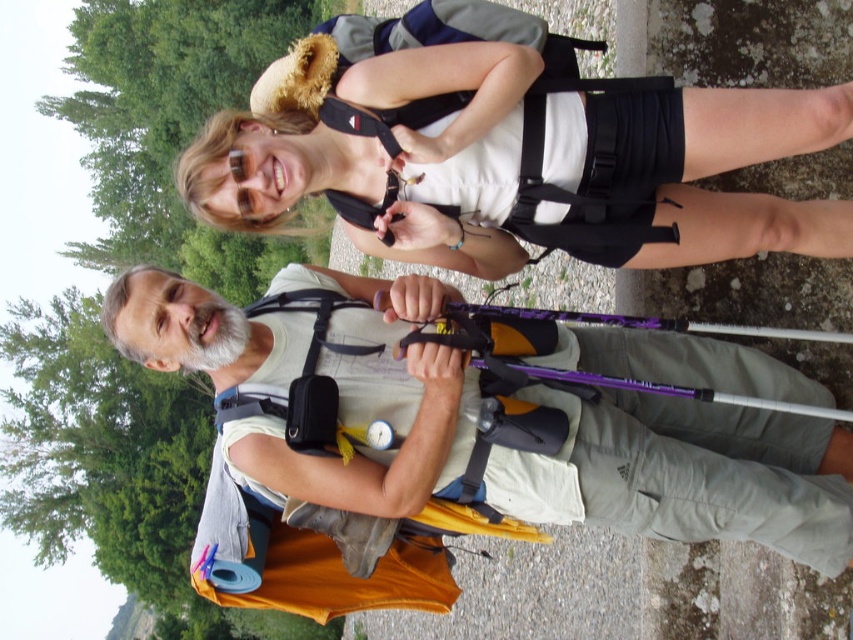
Can you confirm if matte gray shirt at center is smaller than purple glossy ski pole at center?

Incorrect, matte gray shirt at center is not smaller in size than purple glossy ski pole at center.

Is matte gray shirt at center thinner than purple glossy ski pole at center?

In fact, matte gray shirt at center might be wider than purple glossy ski pole at center.

Who is more distant from viewer, [613,464] or [700,323]?

The point [613,464] is more distant.

At what (x,y) coordinates should I click in order to perform the action: click on matte gray shirt at center. Please return your answer as a coordinate pair (x, y). The image size is (853, 640). Looking at the image, I should click on (688, 474).

Is matte black backpack at upper center smaller than purple glossy ski pole at center?

Yes.

Is matte black backpack at upper center above purple glossy ski pole at center?

Correct, matte black backpack at upper center is located above purple glossy ski pole at center.

Identify the location of matte black backpack at upper center. (383, 157).

Between matte gray shirt at center and matte black backpack at upper center, which one is positioned higher?

matte black backpack at upper center

Is point (108, 337) more distant than point (767, 196)?

That is True.

Identify the location of matte gray shirt at center. (688, 474).